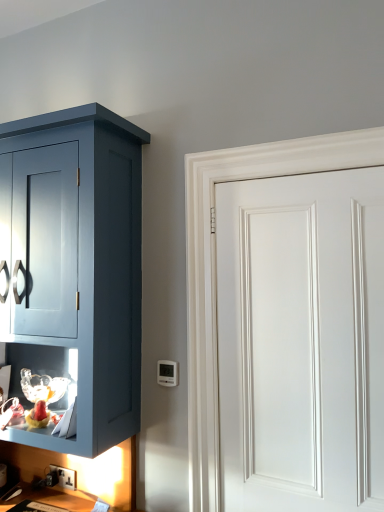
At what (x,y) coordinates should I click in order to perform the action: click on white smooth door at right. Please return your answer as a coordinate pair (x, y). Looking at the image, I should click on (301, 339).

Describe the element at coordinates (65, 477) in the screenshot. I see `black plastic electric outlet at lower left` at that location.

This screenshot has height=512, width=384. Identify the location of white plastic thermostat at lower center. (167, 373).

Is point (71, 488) less distant than point (158, 381)?

No.

Considering the positions of objects black plastic electric outlet at lower left and white plastic thermostat at lower center in the image provided, who is in front, black plastic electric outlet at lower left or white plastic thermostat at lower center?

white plastic thermostat at lower center is more forward.

In the scene shown: Can you tell me how much black plastic electric outlet at lower left and white plastic thermostat at lower center differ in facing direction?

1.2 degrees.

Is black plastic electric outlet at lower left beside white plastic thermostat at lower center?

No, black plastic electric outlet at lower left is not with white plastic thermostat at lower center.

Does white smooth door at right appear on the right side of black plastic electric outlet at lower left?

Correct, you'll find white smooth door at right to the right of black plastic electric outlet at lower left.

What's the angular difference between white smooth door at right and black plastic electric outlet at lower left's facing directions?

The angle between the facing direction of white smooth door at right and the facing direction of black plastic electric outlet at lower left is 0.716 degrees.

Does white smooth door at right turn towards black plastic electric outlet at lower left?

No, white smooth door at right is not aimed at black plastic electric outlet at lower left.

Is white smooth door at right completely or partially outside of black plastic electric outlet at lower left?

white smooth door at right lies outside black plastic electric outlet at lower left's area.

Between white smooth door at right and white plastic thermostat at lower center, which one appears on the left side from the viewer's perspective?

Positioned to the left is white plastic thermostat at lower center.

Is point (363, 194) behind point (173, 380)?

That is False.

Considering the relative sizes of white smooth door at right and white plastic thermostat at lower center in the image provided, is white smooth door at right thinner than white plastic thermostat at lower center?

Incorrect, the width of white smooth door at right is not less than that of white plastic thermostat at lower center.

Is black plastic electric outlet at lower left with white smooth door at right?

They are not placed beside each other.

Looking at this image, is black plastic electric outlet at lower left not within white smooth door at right?

Yes, black plastic electric outlet at lower left is not within white smooth door at right.

Where is `electric outlet below the white smooth door at right (from a real-world perspective)`? Image resolution: width=384 pixels, height=512 pixels. electric outlet below the white smooth door at right (from a real-world perspective) is located at coordinates (65, 477).

Which object is further away from the camera taking this photo, black plastic electric outlet at lower left or white smooth door at right?

black plastic electric outlet at lower left is further from the camera.

Is white plastic thermostat at lower center thinner than white smooth door at right?

Yes, white plastic thermostat at lower center is thinner than white smooth door at right.

Where is `door on the right side of white plastic thermostat at lower center`? The height and width of the screenshot is (512, 384). door on the right side of white plastic thermostat at lower center is located at coordinates (301, 339).

Considering the relative sizes of white plastic thermostat at lower center and white smooth door at right in the image provided, is white plastic thermostat at lower center taller than white smooth door at right?

In fact, white plastic thermostat at lower center may be shorter than white smooth door at right.

Is white plastic thermostat at lower center not near white smooth door at right?

Actually, white plastic thermostat at lower center and white smooth door at right are a little close together.

From a real-world perspective, which is physically above, white plastic thermostat at lower center or black plastic electric outlet at lower left?

white plastic thermostat at lower center.

Which is correct: white plastic thermostat at lower center is inside black plastic electric outlet at lower left, or outside of it?

white plastic thermostat at lower center lies outside black plastic electric outlet at lower left.

Consider the image. Is white plastic thermostat at lower center far from black plastic electric outlet at lower left?

That's not correct — white plastic thermostat at lower center is a little close to black plastic electric outlet at lower left.

How many degrees apart are the facing directions of white plastic thermostat at lower center and black plastic electric outlet at lower left?

1.2 degrees separate the facing orientations of white plastic thermostat at lower center and black plastic electric outlet at lower left.

This screenshot has height=512, width=384. I want to click on electric outlet beneath the white plastic thermostat at lower center (from a real-world perspective), so click(65, 477).

The image size is (384, 512). Identify the location of door lying in front of the black plastic electric outlet at lower left. (301, 339).

From the image, which object appears to be farther from black plastic electric outlet at lower left, white plastic thermostat at lower center or white smooth door at right?

Based on the image, white smooth door at right appears to be further to black plastic electric outlet at lower left.

From the image, which object appears to be farther from white plastic thermostat at lower center, black plastic electric outlet at lower left or white smooth door at right?

black plastic electric outlet at lower left is further to white plastic thermostat at lower center.

Estimate the real-world distances between objects in this image. Which object is closer to black plastic electric outlet at lower left, white smooth door at right or white plastic thermostat at lower center?

Based on the image, white plastic thermostat at lower center appears to be nearer to black plastic electric outlet at lower left.

When comparing their distances from white plastic thermostat at lower center, does white smooth door at right or black plastic electric outlet at lower left seem further?

black plastic electric outlet at lower left.

Based on their spatial positions, is black plastic electric outlet at lower left or white plastic thermostat at lower center closer to white smooth door at right?

white plastic thermostat at lower center.

Based on the photo, considering their positions, is white plastic thermostat at lower center positioned closer to white smooth door at right than black plastic electric outlet at lower left?

The object closer to white smooth door at right is white plastic thermostat at lower center.

Where is `light switch between black plastic electric outlet at lower left and white smooth door at right`? The width and height of the screenshot is (384, 512). light switch between black plastic electric outlet at lower left and white smooth door at right is located at coordinates (167, 373).